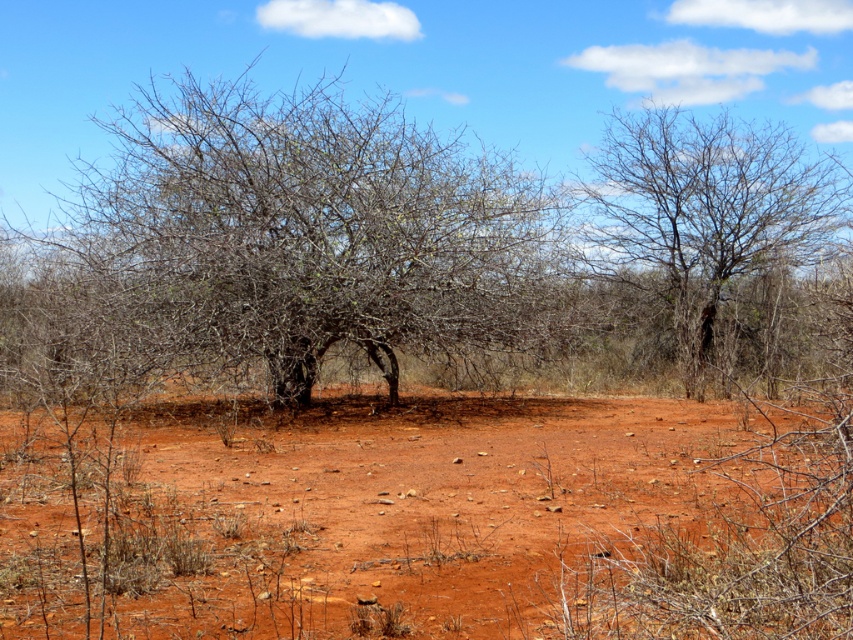
Looking at this image, you are a hiker trying to decide where to rest in the dry, arid landscape. You notice two areas of shade created by the bare branches at center and the bare branches at upper right. Which area of shade is wider?

The shade created by the bare branches at center is wider because the bare branches at center has a larger width than the bare branches at upper right.